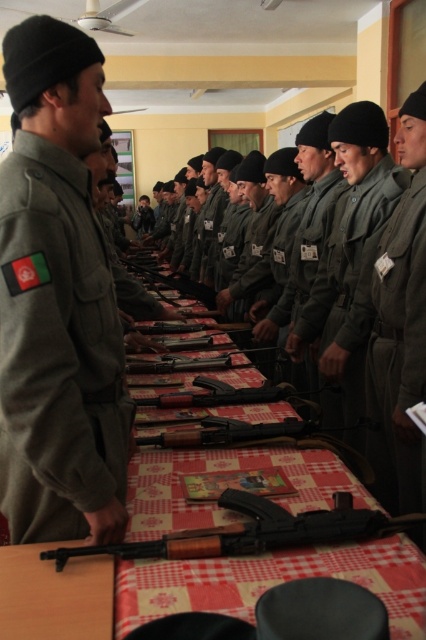
Question: Which point is farther to the camera?

Choices:
 (A) (344, 218)
 (B) (31, 508)
 (C) (258, 426)
 (D) (290, 518)

Answer: (A)

Question: Can you confirm if green matte uniform at left is bigger than red checkered tablecloth at center?

Choices:
 (A) yes
 (B) no

Answer: (B)

Question: Observing the image, what is the correct spatial positioning of green matte uniform at left in reference to black plastic shotgun at lower center?

Choices:
 (A) right
 (B) left

Answer: (B)

Question: Does green matte uniform at left lie in front of green matte uniform at center?

Choices:
 (A) yes
 (B) no

Answer: (A)

Question: Estimate the real-world distances between objects in this image. Which object is farther from the red checkered tablecloth at center?

Choices:
 (A) green matte uniform at left
 (B) black plastic shotgun at lower center

Answer: (A)

Question: Which of the following is the farthest from the observer?

Choices:
 (A) matte black shotgun at center
 (B) red checkered tablecloth at center
 (C) green matte uniform at center

Answer: (C)